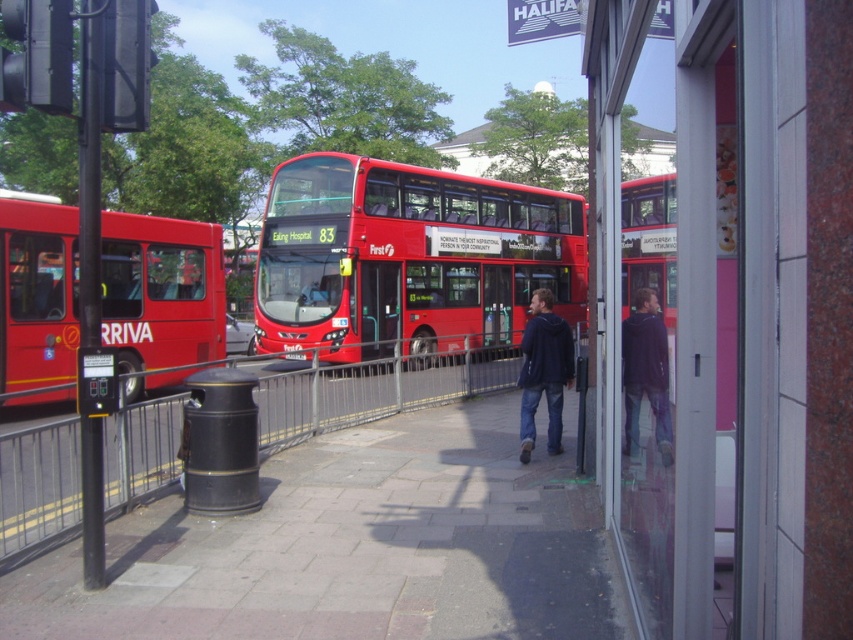
Question: Is metallic gray fence at left positioned behind dark blue jacket at center?

Choices:
 (A) no
 (B) yes

Answer: (A)

Question: Which point is farther to the camera?

Choices:
 (A) (553, 317)
 (B) (339, 300)
 (C) (55, 269)

Answer: (B)

Question: Is red matte double-decker bus at center positioned before dark blue jacket at center?

Choices:
 (A) no
 (B) yes

Answer: (A)

Question: Which point is farther to the camera?

Choices:
 (A) metallic gray fence at left
 (B) dark blue jacket at center
 (C) matte red bus at left

Answer: (C)

Question: Which point is closer to the camera?

Choices:
 (A) dark blue jacket at center
 (B) red matte double-decker bus at center
 (C) dark blue hoodie at center
 (D) matte red bus at left

Answer: (C)

Question: Is metallic gray fence at left in front of dark blue hoodie at center?

Choices:
 (A) no
 (B) yes

Answer: (A)